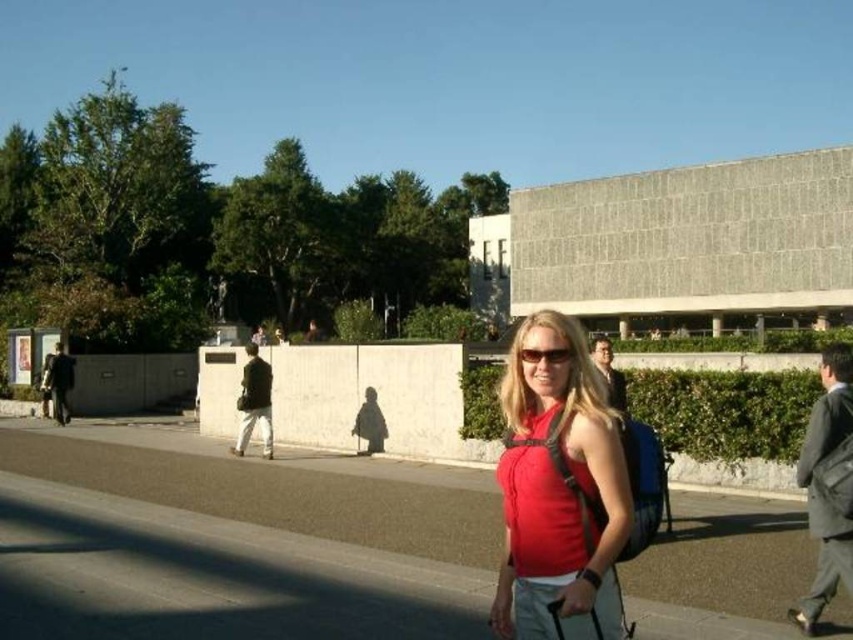
You are a photographer trying to capture a wide shot of the scene. The camera you are using has a maximum width of 30 cm. Given that the gray asphalt pavement at center is wider than the red matte tank top at center, can you fit both objects within the camera frame?

The gray asphalt pavement at center is wider than the red matte tank top at center. Since the camera has a maximum width of 30 cm, the total width of both objects combined must be less than or equal to 30 cm. However, without knowing the exact width of each object, it is impossible to determine if they can fit within the frame.

You are a fashion designer observing a model wearing the red matte tank top at center and matte black sunglasses at center. Which item has a greater width?

The red matte tank top at center has a greater width than the matte black sunglasses at center.

Based on the coordinates provided, where exactly is the red matte tank top at center located in the image?

The red matte tank top at center is located at the coordinates point (x=558, y=490) in the image.